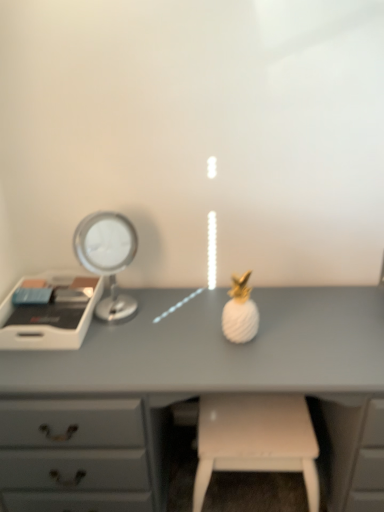
Identify the location of vacant space to the right of white plastic tray at left. The width and height of the screenshot is (384, 512). (139, 331).